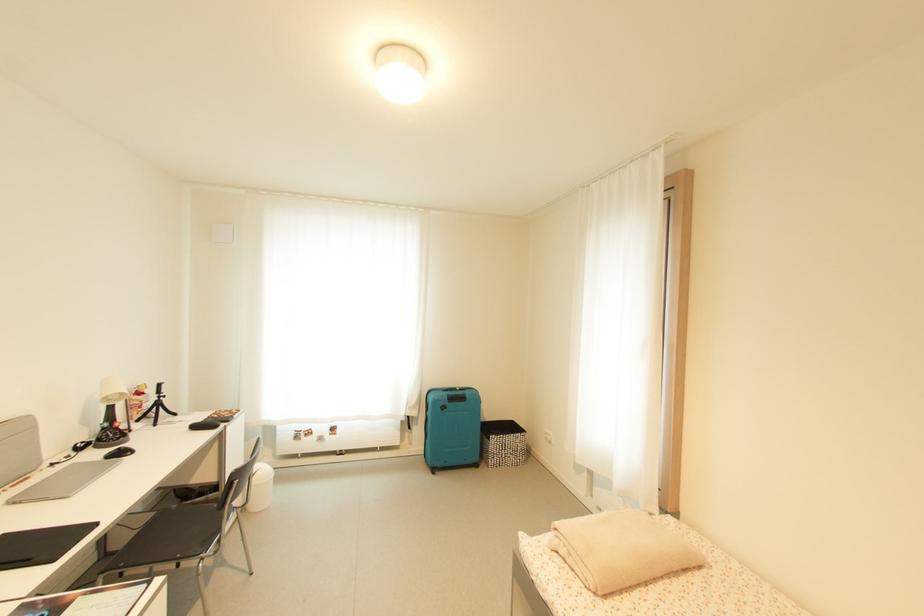
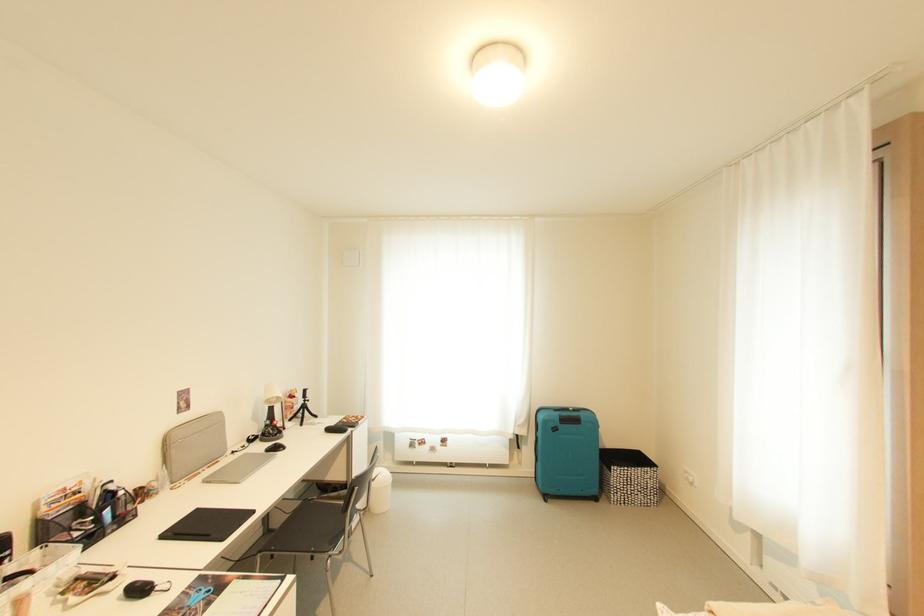
In the second image, find the point that corresponds to (x=495, y=448) in the first image.

(617, 482)